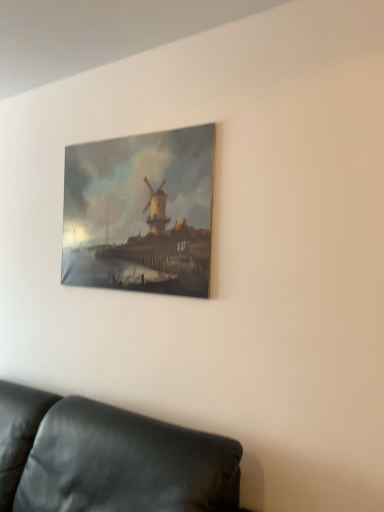
The height and width of the screenshot is (512, 384). Find the location of `leather couch at lower left`. leather couch at lower left is located at coordinates (107, 458).

Measure the distance between point (x=36, y=497) and camera.

The distance of point (x=36, y=497) from camera is 6.11 feet.

Image resolution: width=384 pixels, height=512 pixels. What do you see at coordinates (107, 458) in the screenshot? I see `leather couch at lower left` at bounding box center [107, 458].

Identify the location of leather couch at lower left. (107, 458).